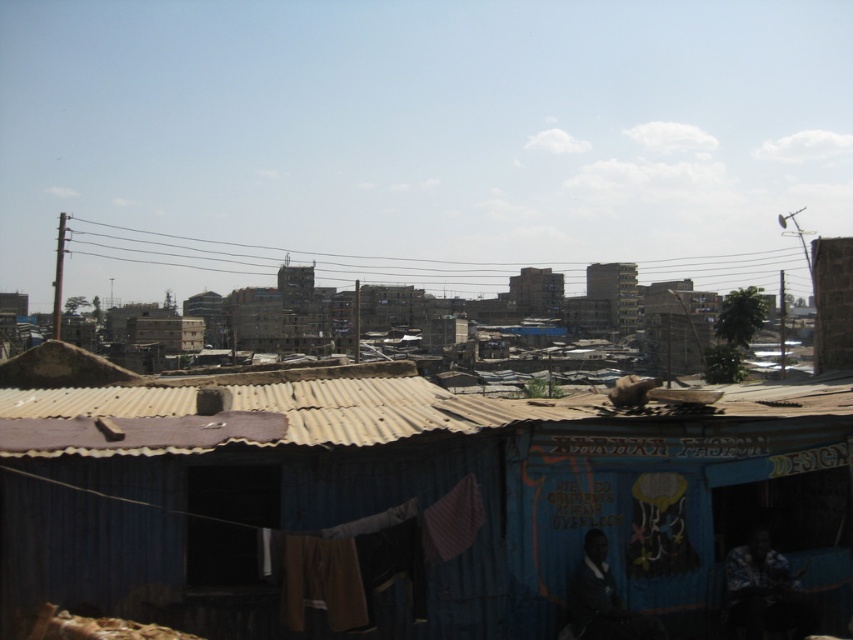
Does blue corrugated metal hut at center appear under corrugated metal roof at center?

Correct, blue corrugated metal hut at center is located below corrugated metal roof at center.

Based on the photo, between blue corrugated metal hut at center and corrugated metal roof at center, which one has less height?

blue corrugated metal hut at center is shorter.

Is point (244, 396) positioned behind point (136, 397)?

Yes, it is behind point (136, 397).

Image resolution: width=853 pixels, height=640 pixels. I want to click on blue corrugated metal hut at center, so click(x=404, y=502).